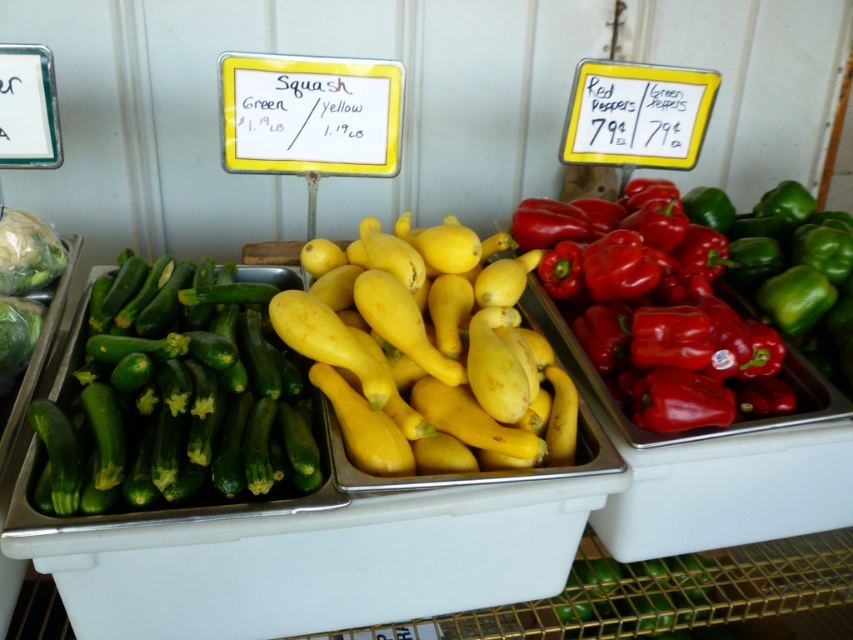
Question: Among these points, which one is nearest to the camera?

Choices:
 (A) (445, 420)
 (B) (88, 413)

Answer: (B)

Question: Which point is closer to the camera?

Choices:
 (A) green smooth zucchini at left
 (B) yellow matte squash at center

Answer: (A)

Question: Is yellow matte squash at center smaller than green smooth zucchini at left?

Choices:
 (A) no
 (B) yes

Answer: (A)

Question: From the image, what is the correct spatial relationship of yellow matte squash at center in relation to green smooth zucchini at left?

Choices:
 (A) below
 (B) above

Answer: (B)

Question: Is yellow matte squash at center closer to camera compared to green smooth zucchini at left?

Choices:
 (A) yes
 (B) no

Answer: (B)